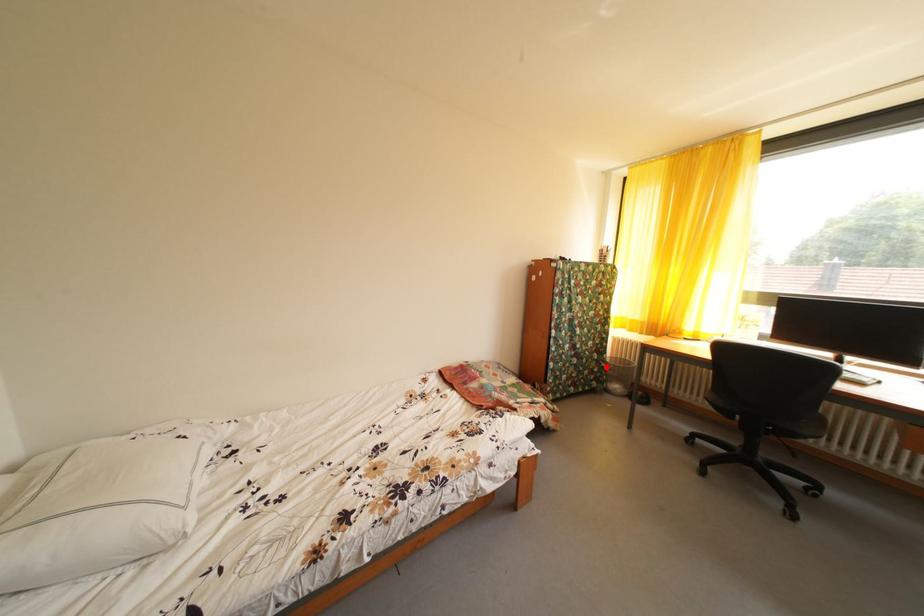
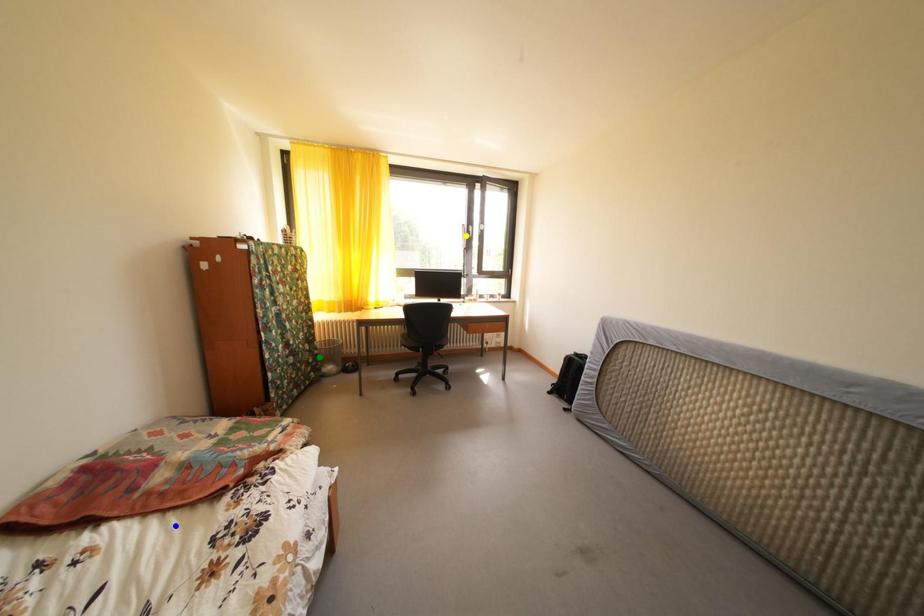
Question: I am providing you with two images of the same scene from different viewpoints. A red point is marked on the first image. You are given multiple points on the second image. Which spot in image 2 lines up with the point in image 1?

Choices:
 (A) green point
 (B) yellow point
 (C) blue point

Answer: (A)